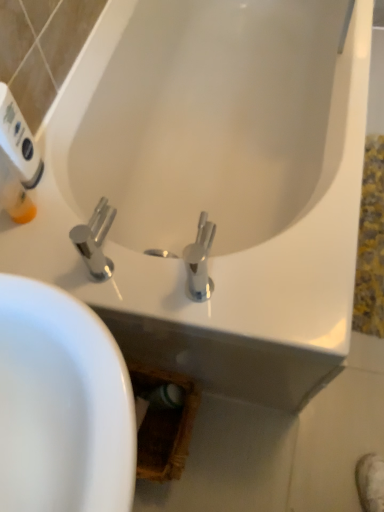
The image size is (384, 512). What are the coordinates of `free space in front of polished chrome faucet at center` in the screenshot? It's located at (130, 298).